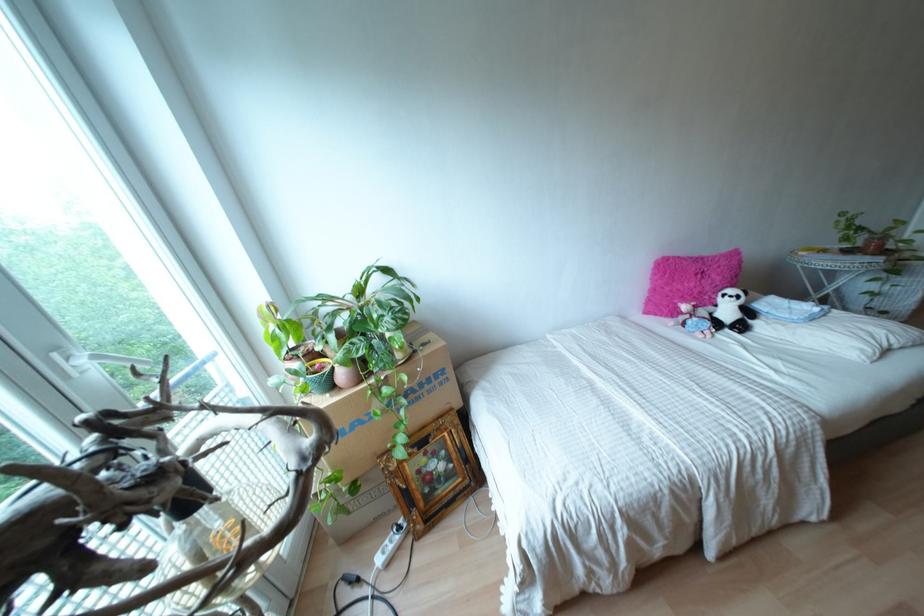
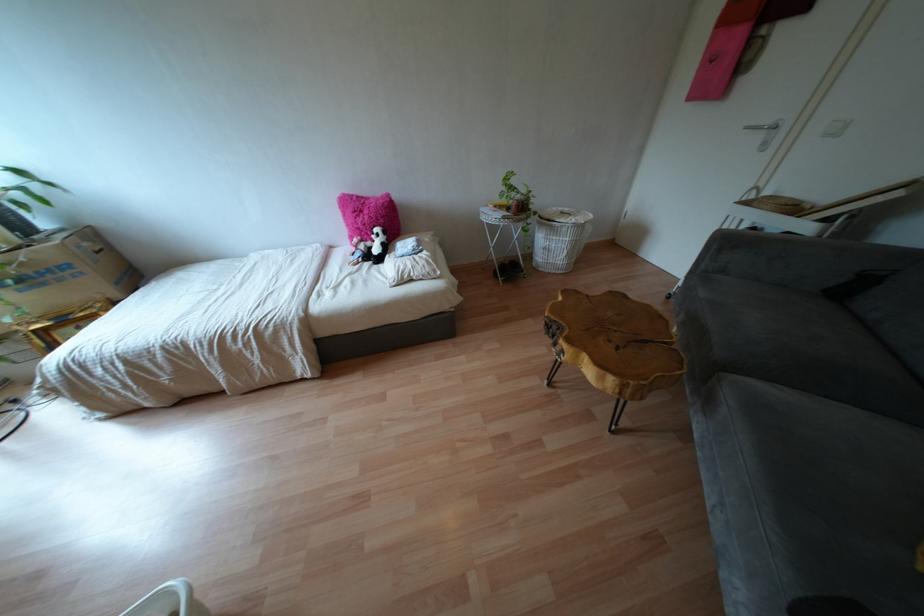
Where in the second image is the point corresponding to point (718, 277) from the first image?

(365, 217)